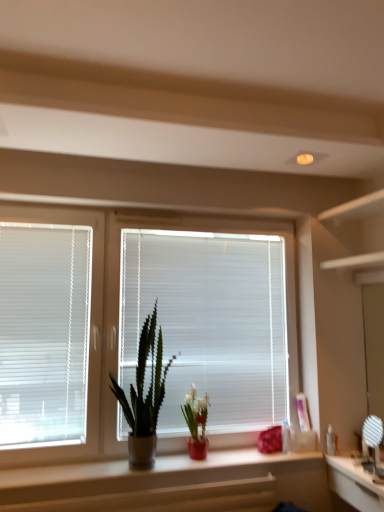
Identify the location of free point to the right of matte red vase at center, which is counted as the first houseplant, starting from the right. This screenshot has height=512, width=384. (225, 460).